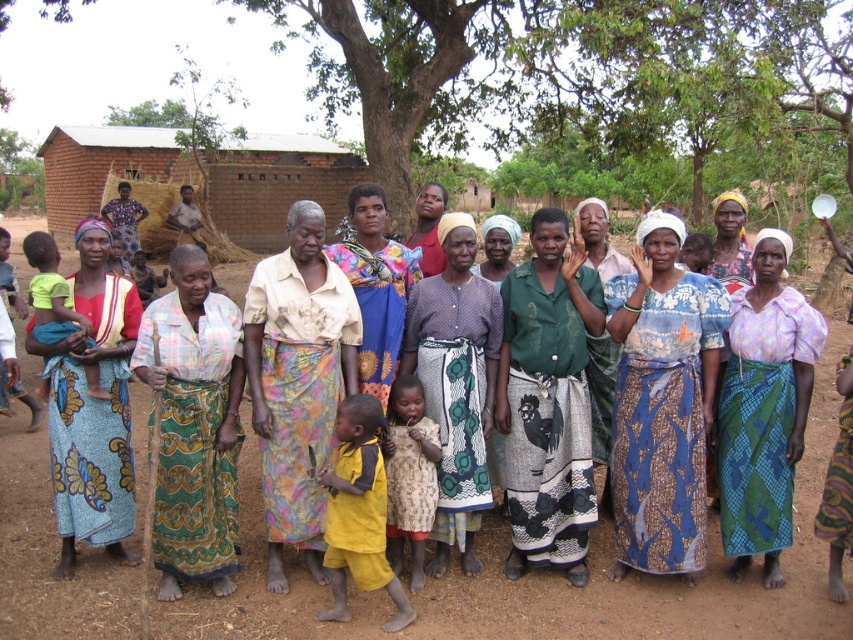
Is green leafy tree at upper center in front of blue printed fabric at center?

No, green leafy tree at upper center is behind blue printed fabric at center.

Is green leafy tree at upper center thinner than blue printed fabric at center?

Incorrect, green leafy tree at upper center's width is not less than blue printed fabric at center's.

You are a GUI agent. You are given a task and a screenshot of the screen. Output one action in this format:
    pyautogui.click(x=<x>, y=<y>)
    Task: Click on the green leafy tree at upper center
    The image size is (853, 640).
    Given the screenshot: What is the action you would take?
    tap(581, 84)

Is light beige fabric skirt at center shorter than yellow fabric baby at left?

No.

Can you confirm if light beige fabric skirt at center is thinner than yellow fabric baby at left?

No.

What do you see at coordinates (299, 381) in the screenshot? The image size is (853, 640). I see `light beige fabric skirt at center` at bounding box center [299, 381].

Where is `light beige fabric skirt at center`? This screenshot has height=640, width=853. light beige fabric skirt at center is located at coordinates (299, 381).

Is printed cotton dress at center positioned behind matte green dress at center?

No, it is in front of matte green dress at center.

Between point (171, 582) and point (421, 243), which one is positioned behind?

Positioned behind is point (421, 243).

Image resolution: width=853 pixels, height=640 pixels. What are the coordinates of `printed cotton dress at center` in the screenshot? It's located at (194, 426).

Locate an element on the screen. printed cotton dress at center is located at coordinates (194, 426).